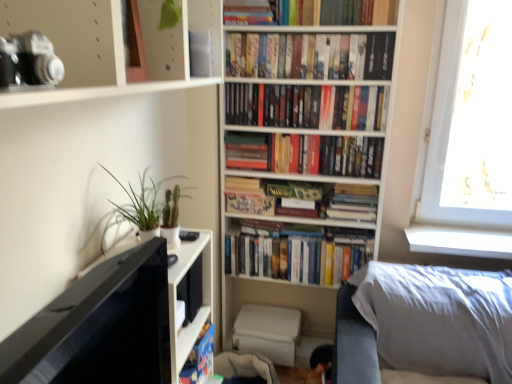
You are a GUI agent. You are given a task and a screenshot of the screen. Output one action in this format:
    pyautogui.click(x=<x>, y=<y>)
    Task: Click on the blank space situated above hardcover books at upper center, which ranks as the second book in top-to-bottom order (from a real-world perspective)
    The width and height of the screenshot is (512, 384).
    Given the screenshot: What is the action you would take?
    pyautogui.click(x=295, y=33)